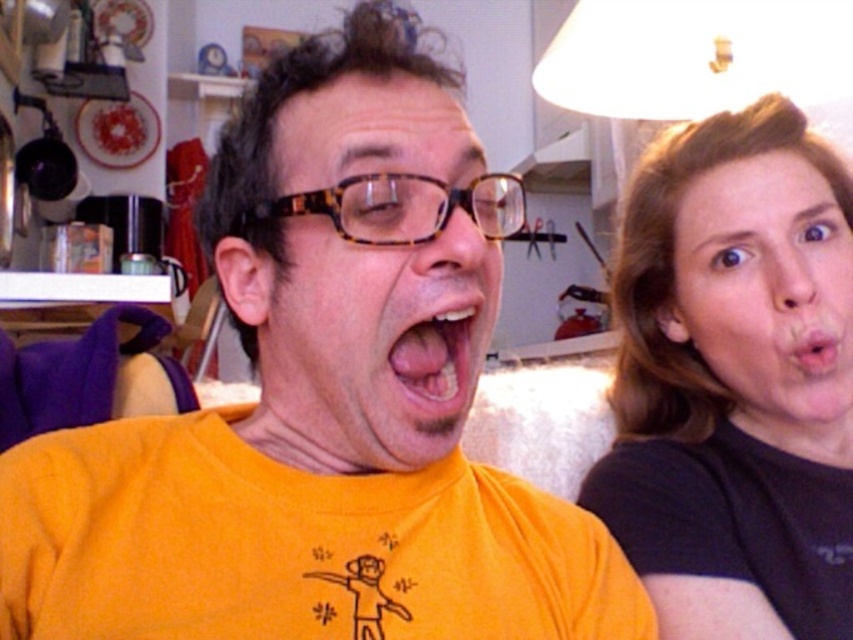
Question: Which of the following is the farthest from the observer?

Choices:
 (A) orange matte/yellow t-shirt at center
 (B) black matte hair at upper right
 (C) pink glossy tongue at center
 (D) pink matte lips at upper right

Answer: (D)

Question: Is pink glossy tongue at center wider than pink matte lips at upper right?

Choices:
 (A) yes
 (B) no

Answer: (B)

Question: Which point appears closest to the camera in this image?

Choices:
 (A) (836, 337)
 (B) (489, 330)

Answer: (B)

Question: Which object appears closest to the camera in this image?

Choices:
 (A) matte skin face at right
 (B) pink glossy tongue at center
 (C) pink matte lips at upper right

Answer: (B)

Question: Can you confirm if matte skin face at right is wider than pink matte lips at upper right?

Choices:
 (A) yes
 (B) no

Answer: (A)

Question: Does black matte hair at upper right have a lesser width compared to matte skin face at right?

Choices:
 (A) no
 (B) yes

Answer: (A)